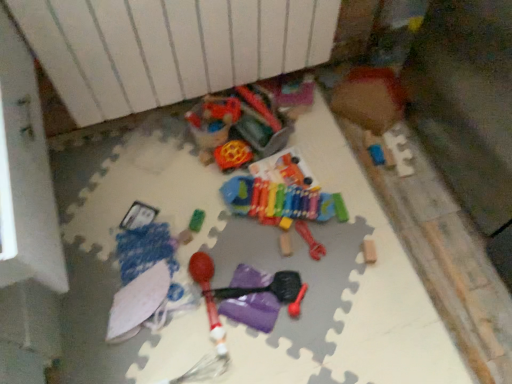
Question: From the image's perspective, is wooden block at center, the 4th toy when ordered from bottom to top, under white matte umbrella at lower left, arranged as the second toy when ordered from the bottom?

Choices:
 (A) no
 (B) yes

Answer: (A)

Question: Considering the relative sizes of wooden block at center, the 4th toy when ordered from bottom to top, and white matte umbrella at lower left, the eighth toy positioned from the top, in the image provided, is wooden block at center, the 4th toy when ordered from bottom to top, wider than white matte umbrella at lower left, the eighth toy positioned from the top,?

Choices:
 (A) yes
 (B) no

Answer: (B)

Question: Is wooden block at center, which is the sixth toy in top-to-bottom order, smaller than white matte umbrella at lower left, the eighth toy positioned from the top?

Choices:
 (A) no
 (B) yes

Answer: (B)

Question: Can you confirm if wooden block at center, which is the sixth toy in top-to-bottom order, is taller than white matte umbrella at lower left, arranged as the second toy when ordered from the bottom?

Choices:
 (A) yes
 (B) no

Answer: (B)

Question: Is white matte umbrella at lower left, the eighth toy positioned from the top, a part of wooden block at center, which is the sixth toy in top-to-bottom order?

Choices:
 (A) no
 (B) yes

Answer: (A)

Question: Is wooden block at center, the 4th toy when ordered from bottom to top, positioned with its back to white matte umbrella at lower left, the eighth toy positioned from the top?

Choices:
 (A) yes
 (B) no

Answer: (B)

Question: Is wooden block at center, the 4th toy when ordered from bottom to top, positioned with its back to rubber chew toy at center, the 5th toy in the top-to-bottom sequence?

Choices:
 (A) yes
 (B) no

Answer: (B)

Question: From the image's perspective, is wooden block at center, which is the sixth toy in top-to-bottom order, under rubber chew toy at center, acting as the 5th toy starting from the bottom?

Choices:
 (A) no
 (B) yes

Answer: (B)

Question: Can rubber chew toy at center, the 5th toy in the top-to-bottom sequence, be found inside wooden block at center, which is the sixth toy in top-to-bottom order?

Choices:
 (A) yes
 (B) no

Answer: (B)

Question: Does wooden block at center, the 4th toy when ordered from bottom to top, appear on the left side of rubber chew toy at center, acting as the 5th toy starting from the bottom?

Choices:
 (A) yes
 (B) no

Answer: (A)

Question: Does wooden block at center, the 4th toy when ordered from bottom to top, appear on the right side of rubber chew toy at center, the 5th toy in the top-to-bottom sequence?

Choices:
 (A) no
 (B) yes

Answer: (A)

Question: Is wooden block at center, which is the sixth toy in top-to-bottom order, in contact with rubber chew toy at center, the 5th toy in the top-to-bottom sequence?

Choices:
 (A) yes
 (B) no

Answer: (A)

Question: Would you say white matte umbrella at lower left, arranged as the second toy when ordered from the bottom, is part of green rubber toy at center, which is the 4th toy from top to bottom,'s contents?

Choices:
 (A) no
 (B) yes

Answer: (A)